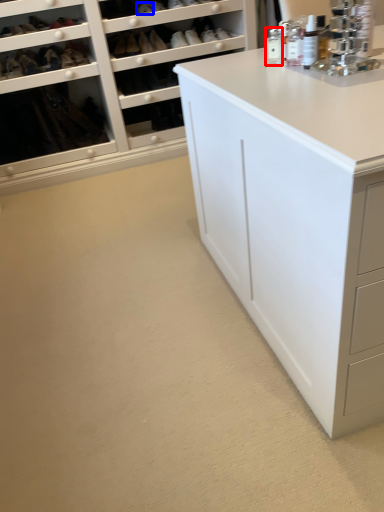
Question: Among these objects, which one is farthest to the camera, toiletry (highlighted by a red box) or shoe (highlighted by a blue box)?

Choices:
 (A) toiletry
 (B) shoe

Answer: (B)